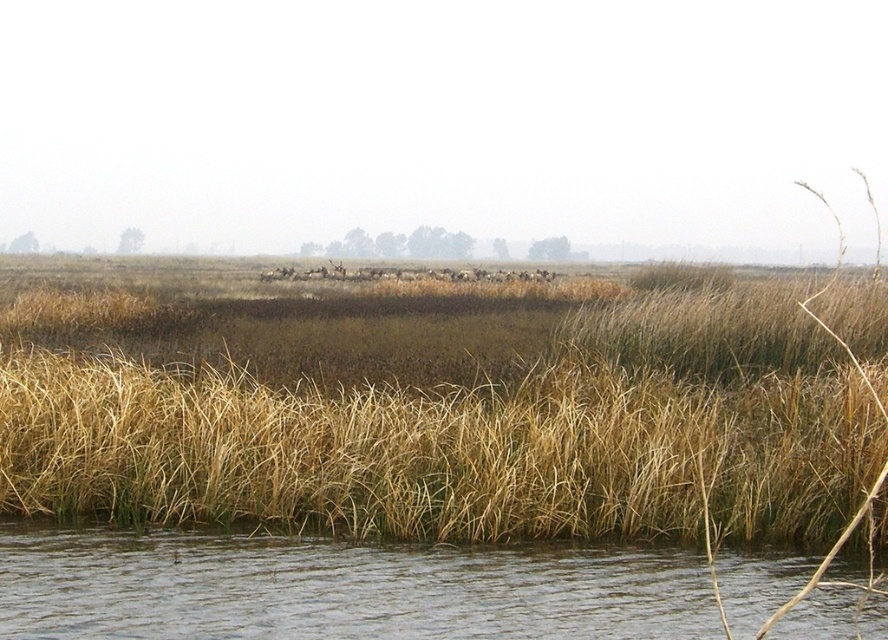
Who is higher up, dry grass at center or clear water at lower center?

dry grass at center is above.

Between point (694, 365) and point (434, 616), which one is positioned in front?

Positioned in front is point (434, 616).

Where is `dry grass at center`? This screenshot has width=888, height=640. dry grass at center is located at coordinates (437, 419).

Between clear water at lower center and brown fuzzy deer at center, which one has less height?

clear water at lower center is shorter.

Between point (652, 570) and point (323, 273), which one is positioned in front?

Positioned in front is point (652, 570).

The width and height of the screenshot is (888, 640). What do you see at coordinates (371, 588) in the screenshot?
I see `clear water at lower center` at bounding box center [371, 588].

This screenshot has height=640, width=888. I want to click on clear water at lower center, so click(371, 588).

Between dry grass at center and brown fuzzy deer at center, which one has more height?

With more height is dry grass at center.

Who is positioned more to the right, dry grass at center or brown fuzzy deer at center?

dry grass at center is more to the right.

Is point (266, 416) positioned after point (509, 275)?

No, it is in front of (509, 275).

This screenshot has height=640, width=888. In order to click on dry grass at center in this screenshot , I will do `click(437, 419)`.